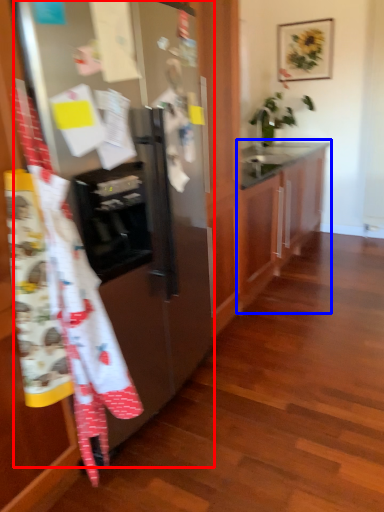
Question: Among these objects, which one is farthest to the camera, refrigerator (highlighted by a red box) or cabinetry (highlighted by a blue box)?

Choices:
 (A) refrigerator
 (B) cabinetry

Answer: (B)